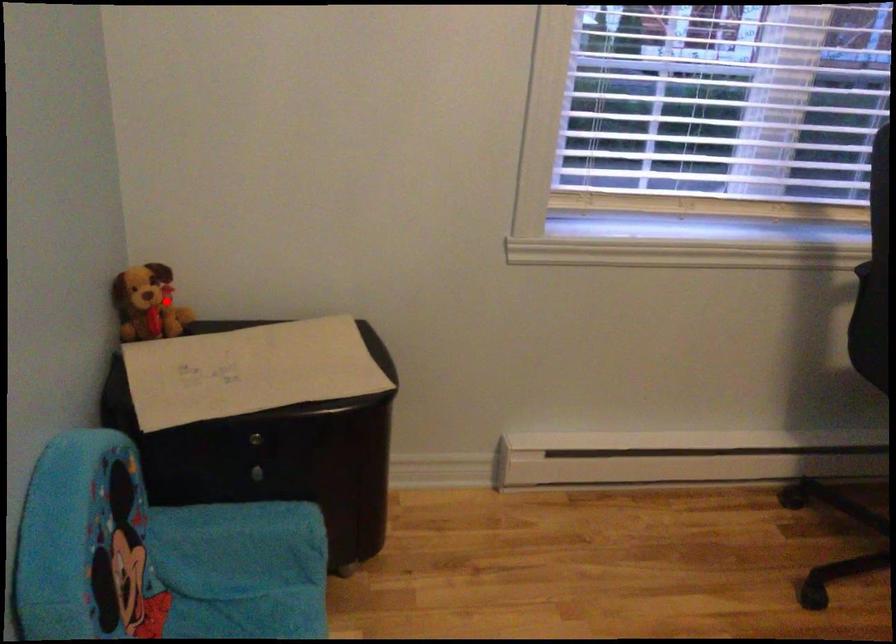
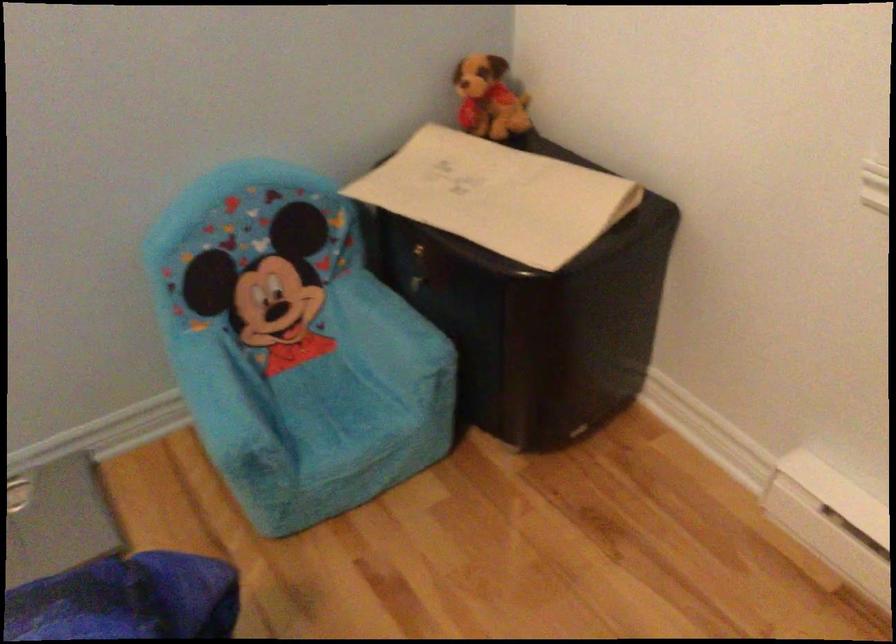
Where in the second image is the point corresponding to the highlighted location from the first image?

(488, 99)